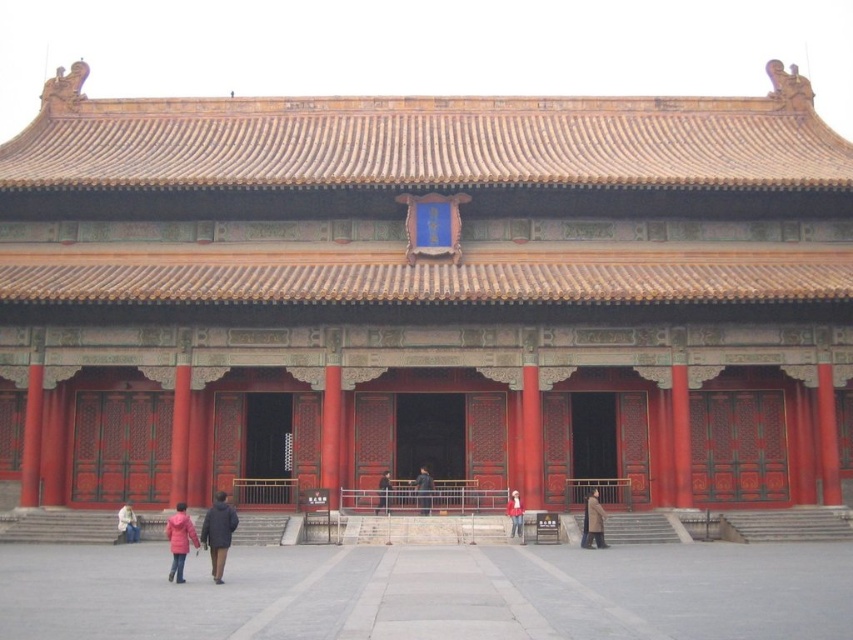
You are a visitor at the Forbidden City and want to compare the positions of your belongings. You have a brown wool coat at center and a white matte jacket at lower left. Which item is placed higher in the scene?

The brown wool coat at center is above the white matte jacket at lower left, so the brown wool coat at center is placed higher in the scene.

You are a visitor at the Forbidden City and want to compare two items of clothing displayed in the entrance hall. Which one is bigger between the dark brown coat at lower center and the red fabric jacket at center?

The dark brown coat at lower center is larger in size compared to the red fabric jacket at center.

You are standing in front of the traditional Chinese building and notice two items near the entrance. You see a dark brown coat at lower center and a red fabric jacket at center. Which item is positioned higher relative to the other?

The dark brown coat at lower center is positioned above the red fabric jacket at center.